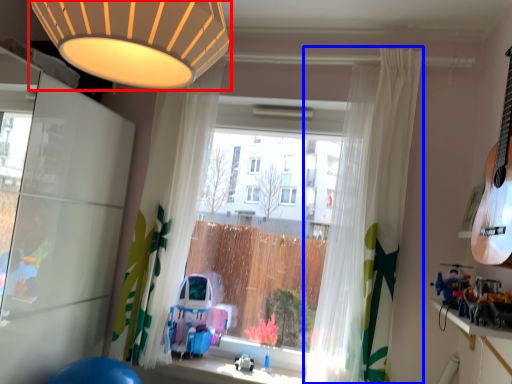
Question: Which of the following is the farthest to the observer, lamp (highlighted by a red box) or curtain (highlighted by a blue box)?

Choices:
 (A) lamp
 (B) curtain

Answer: (B)